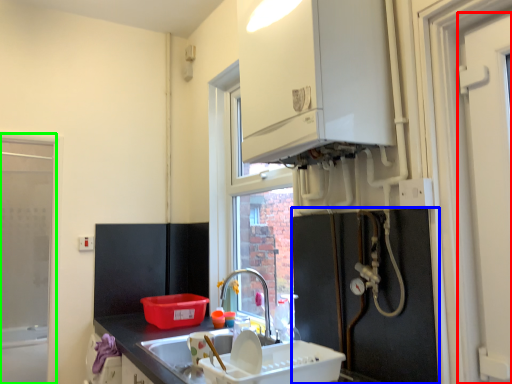
Question: Which object is the closest to the door (highlighted by a red box)? Choose among these: appliance (highlighted by a blue box) or window frame (highlighted by a green box).

Choices:
 (A) appliance
 (B) window frame

Answer: (A)